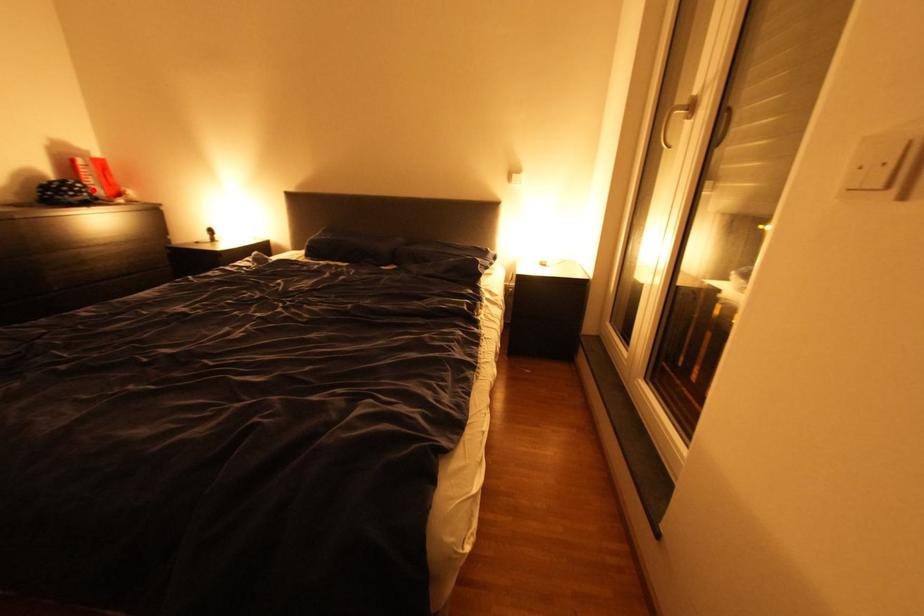
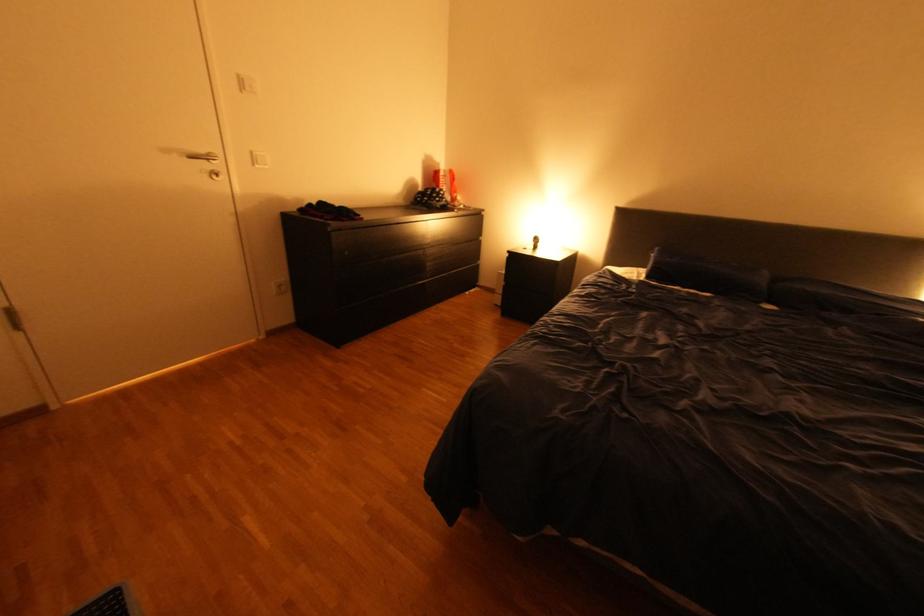
Question: I am providing you with two images of the same scene from different viewpoints. Image1 has a red point marked. In image2, the corresponding 3D location appears at what relative position? Reply with the corresponding letter.

Choices:
 (A) Closer
 (B) Farther

Answer: (A)